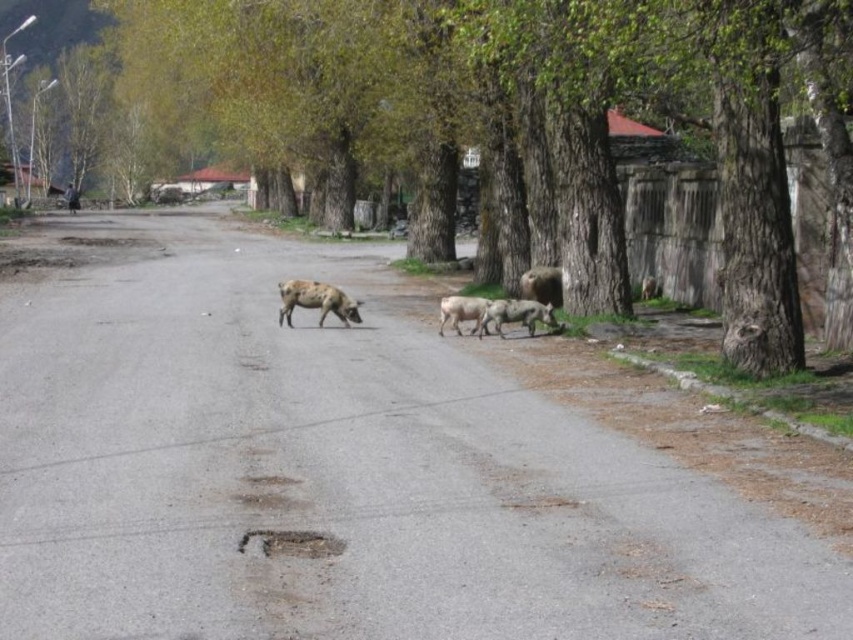
Question: Can you confirm if speckled fur pig at center is positioned above brown woolen sheep at right?

Choices:
 (A) no
 (B) yes

Answer: (A)

Question: Which point appears farthest from the camera in this image?

Choices:
 (A) (554, 294)
 (B) (492, 323)
 (C) (531, 234)
 (D) (321, 321)

Answer: (C)

Question: Is speckled fur pig at center to the right of white woolen sheep at center from the viewer's perspective?

Choices:
 (A) yes
 (B) no

Answer: (B)

Question: Does brown rough tree at center appear over brown woolen sheep at right?

Choices:
 (A) yes
 (B) no

Answer: (A)

Question: Which object is the closest to the speckled fur pig at center?

Choices:
 (A) speckled woolen sheep at center
 (B) brown rough tree at center
 (C) brown woolen sheep at right

Answer: (A)

Question: Among these objects, which one is nearest to the camera?

Choices:
 (A) speckled woolen sheep at center
 (B) white woolen sheep at center
 (C) brown rough tree at center
 (D) speckled fur pig at center

Answer: (C)